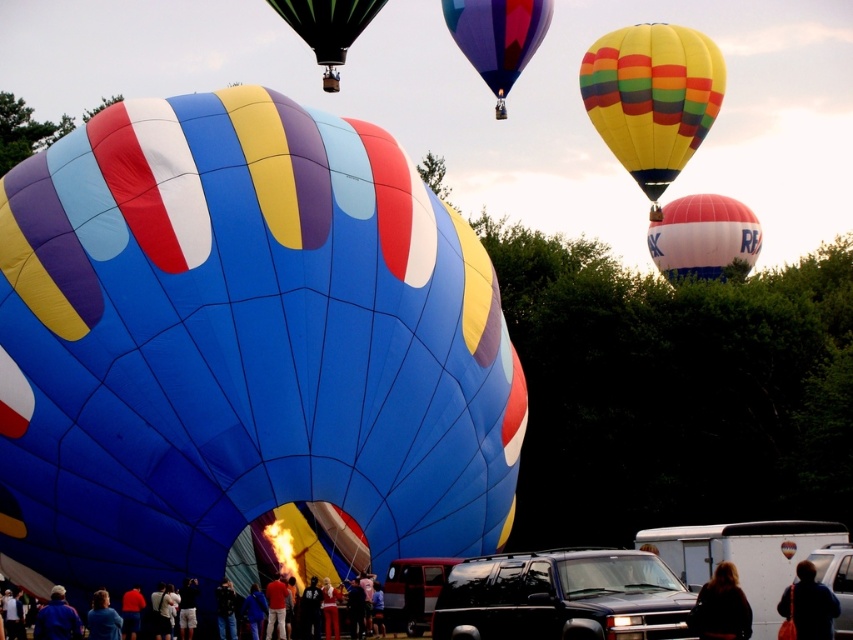
You are standing at the center of the hot air balloon festival and want to take a photo of the shiny purple fabric hot air balloon at upper center and the dark blue jacket at lower right. Which object should you pan your camera to the left to capture first?

The shiny purple fabric hot air balloon at upper center is to the left of the dark blue jacket at lower right, so you should pan your camera to the left to capture the shiny purple fabric hot air balloon at upper center first.

You are standing at the location of the dark blue jacket at lower right and want to reach the shiny purple fabric hot air balloon at upper center. Given that you can walk at a speed of 1.5 meters per second, how many seconds will it take you to reach the balloon?

The shiny purple fabric hot air balloon at upper center is 83.16 meters from the dark blue jacket at lower right. At a walking speed of 1.5 meters per second, it would take approximately 55.44 seconds to reach the balloon.